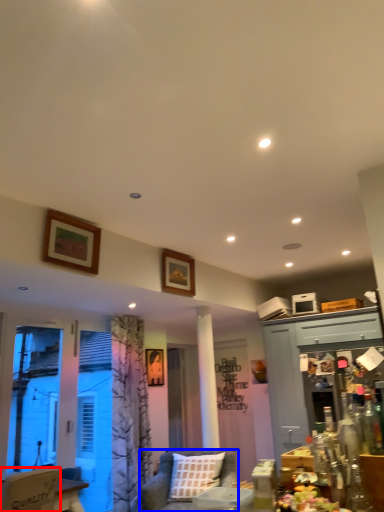
Question: Which point is further to the camera, chair (highlighted by a red box) or studio couch (highlighted by a blue box)?

Choices:
 (A) chair
 (B) studio couch

Answer: (B)